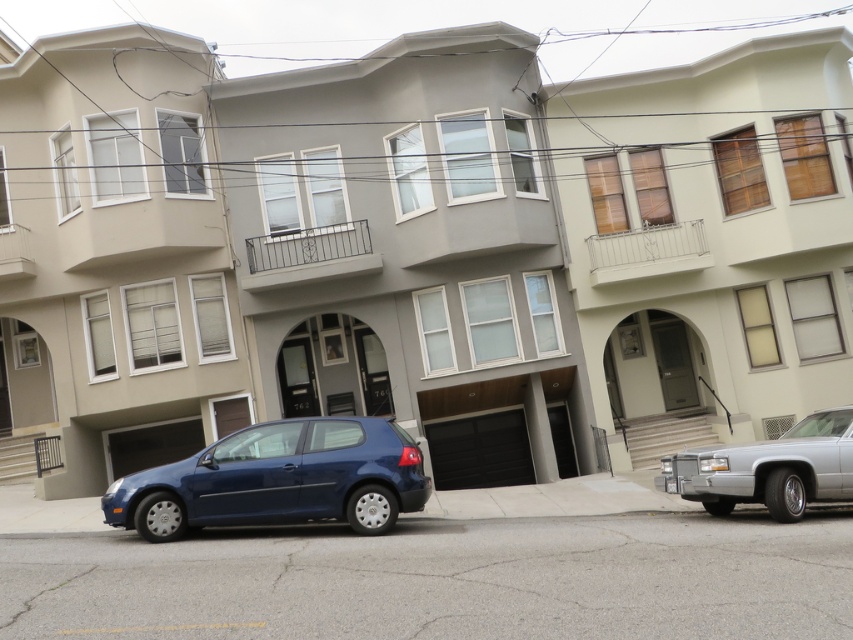
You are standing in front of the row of buildings and want to take a photo. There are two points marked in the image, point 1 at coordinates point (351, 426) and point 2 at coordinates point (799, 513). Which point is closer to your camera?

Point (351, 426) is closer to the camera than point (799, 513) because it is further to the camera than the other point.